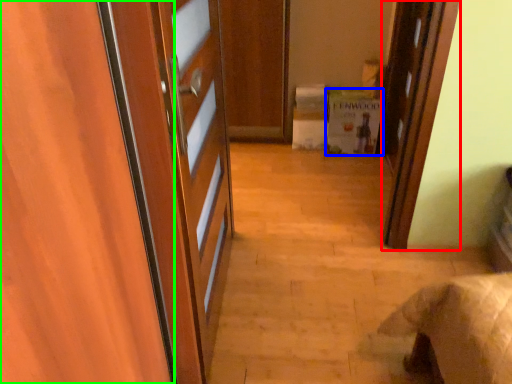
Question: Which object is positioned farthest from door (highlighted by a red box)? Select from cabinetry (highlighted by a blue box) and door (highlighted by a green box).

Choices:
 (A) cabinetry
 (B) door

Answer: (B)